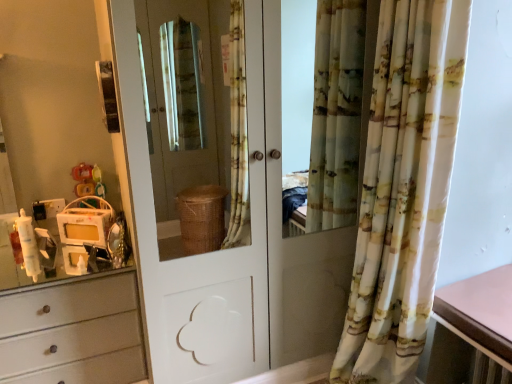
Question: From a real-world perspective, does pink laminate table at right sit lower than printed fabric curtain at right?

Choices:
 (A) yes
 (B) no

Answer: (A)

Question: Considering the relative positions of pink laminate table at right and printed fabric curtain at right in the image provided, is pink laminate table at right to the right of printed fabric curtain at right from the viewer's perspective?

Choices:
 (A) no
 (B) yes

Answer: (B)

Question: Is pink laminate table at right positioned behind printed fabric curtain at right?

Choices:
 (A) no
 (B) yes

Answer: (B)

Question: Can you confirm if pink laminate table at right is shorter than printed fabric curtain at right?

Choices:
 (A) no
 (B) yes

Answer: (B)

Question: Is pink laminate table at right positioned with its back to printed fabric curtain at right?

Choices:
 (A) no
 (B) yes

Answer: (A)

Question: Can printed fabric curtain at right be found inside pink laminate table at right?

Choices:
 (A) yes
 (B) no

Answer: (B)

Question: Can you confirm if printed fabric curtain at right is taller than white glossy door at center?

Choices:
 (A) yes
 (B) no

Answer: (B)

Question: Does printed fabric curtain at right have a lesser width compared to white glossy door at center?

Choices:
 (A) no
 (B) yes

Answer: (B)

Question: Is printed fabric curtain at right looking in the opposite direction of white glossy door at center?

Choices:
 (A) yes
 (B) no

Answer: (B)

Question: Is printed fabric curtain at right facing towards white glossy door at center?

Choices:
 (A) yes
 (B) no

Answer: (B)

Question: From the image's perspective, does printed fabric curtain at right appear lower than white glossy door at center?

Choices:
 (A) no
 (B) yes

Answer: (B)

Question: Considering the relative sizes of printed fabric curtain at right and white glossy door at center in the image provided, is printed fabric curtain at right shorter than white glossy door at center?

Choices:
 (A) yes
 (B) no

Answer: (A)

Question: Considering the relative positions of white glossy door at center and printed fabric curtain at right in the image provided, is white glossy door at center in front of printed fabric curtain at right?

Choices:
 (A) yes
 (B) no

Answer: (B)